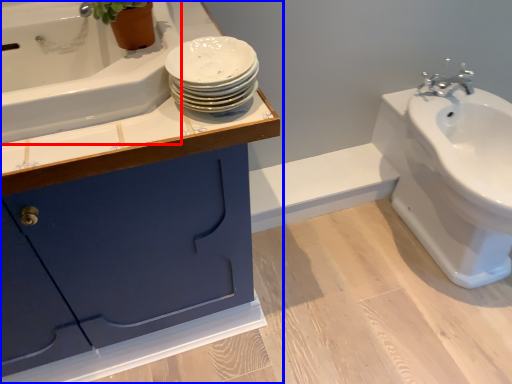
Question: Which object appears closest to the camera in this image, bath (highlighted by a red box) or bathroom cabinet (highlighted by a blue box)?

Choices:
 (A) bath
 (B) bathroom cabinet

Answer: (A)